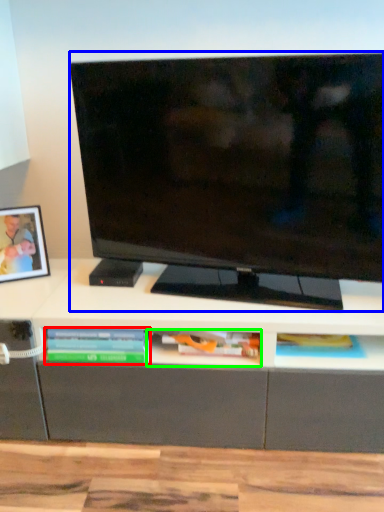
Question: Estimate the real-world distances between objects in this image. Which object is farther from book (highlighted by a red box), television (highlighted by a blue box) or book (highlighted by a green box)?

Choices:
 (A) television
 (B) book

Answer: (A)